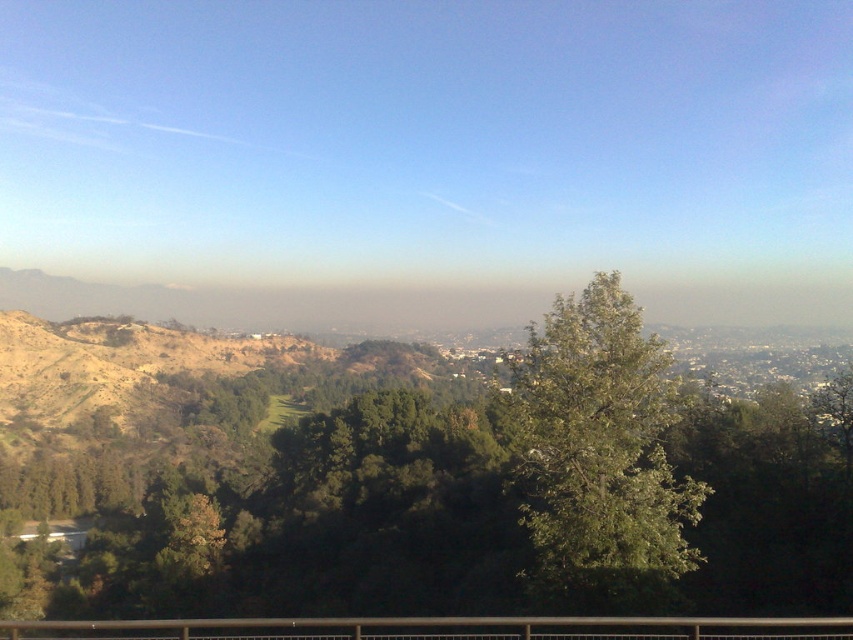
You are standing at the base of the green leafy tree at center and want to walk to the black metal rail at lower center. Which direction should you move to reach the rail?

The green leafy tree at center is above the black metal rail at lower center, so you should move downward to reach the rail.

You are standing at the edge of the hilly landscape and want to cross the black metal rail at lower center to reach the green leafy tree at center. Can you walk directly to the tree without going around the rail?

The green leafy tree at center is smaller than the black metal rail at lower center, so the rail is larger and may block your path. You might need to go around it to reach the tree.

You are standing in the scenic hilly landscape and want to walk from the point at coordinates point (x=556, y=465) to the point at coordinates point (x=613, y=628). Which direction should you face to move towards the destination?

You should face away from the viewer because point (x=556, y=465) is closer to you than point (x=613, y=628), so moving away from your current position would lead you towards the destination.